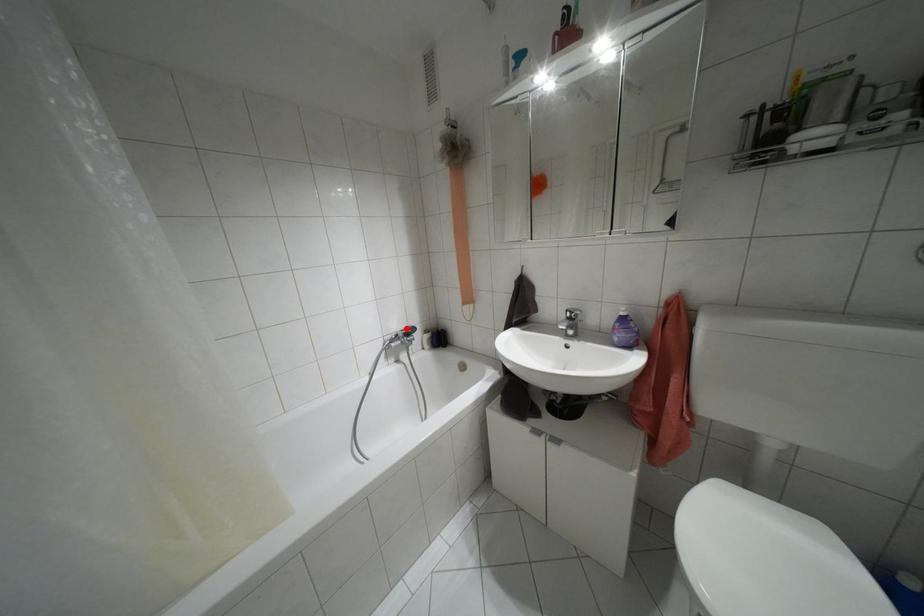
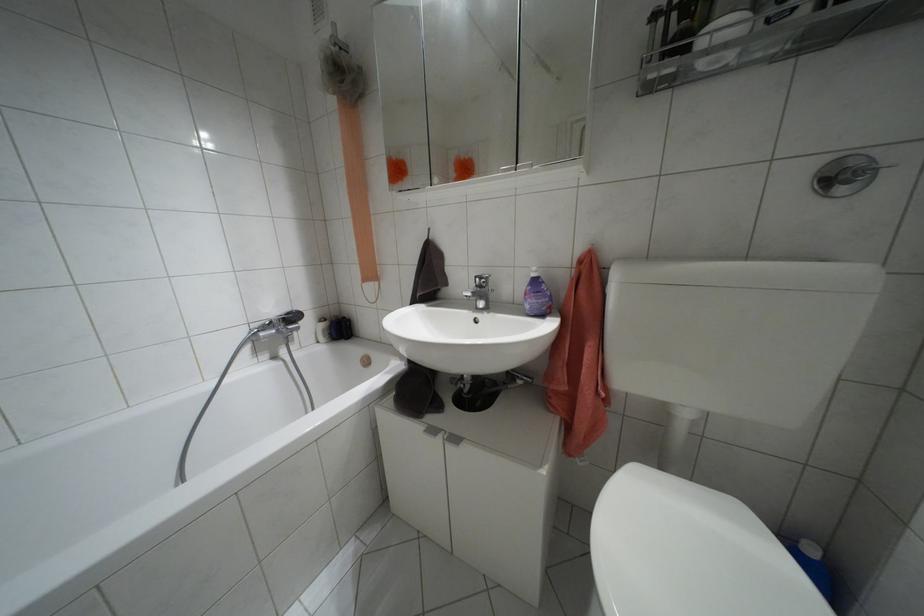
In the second image, find the point that corresponds to the highlighted location in the first image.

(286, 313)